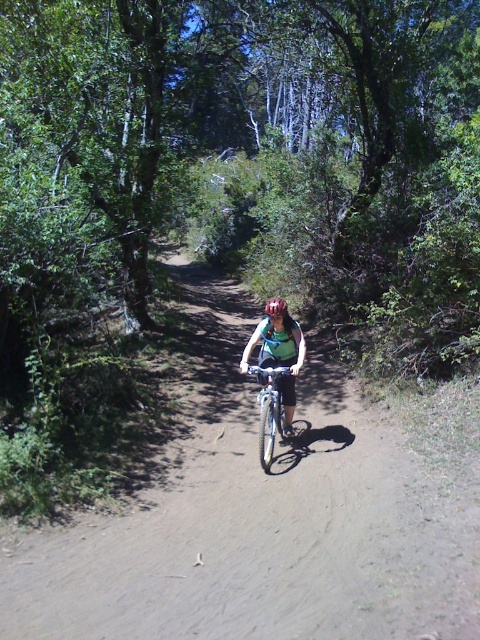
Question: Is matte green shirt at center to the right of matte black helmet at center from the viewer's perspective?

Choices:
 (A) yes
 (B) no

Answer: (A)

Question: Can you confirm if silver metallic bicycle at center is positioned to the right of matte black helmet at center?

Choices:
 (A) yes
 (B) no

Answer: (A)

Question: Is silver metallic bicycle at center positioned at the back of matte black helmet at center?

Choices:
 (A) yes
 (B) no

Answer: (B)

Question: Which of the following is the closest to the observer?

Choices:
 (A) matte green shirt at center
 (B) matte black helmet at center
 (C) silver metallic bicycle at center

Answer: (C)

Question: Estimate the real-world distances between objects in this image. Which object is farther from the matte green shirt at center?

Choices:
 (A) matte black helmet at center
 (B) silver metallic bicycle at center

Answer: (A)

Question: Which object is closer to the camera taking this photo?

Choices:
 (A) silver metallic bicycle at center
 (B) matte green shirt at center

Answer: (A)